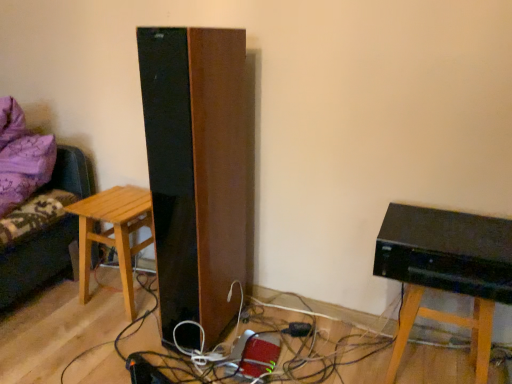
Locate an element on the screen. vacant area that lies in front of black plastic plug at lower center is located at coordinates (300, 359).